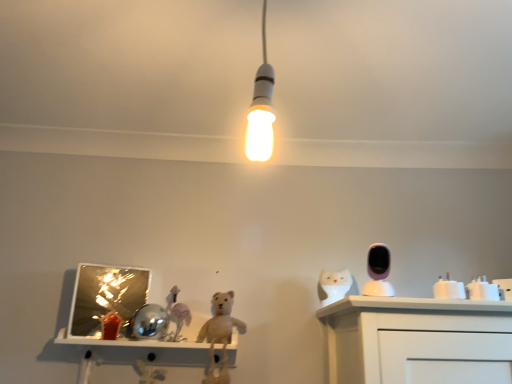
Question: From the image's perspective, is white glossy cup at right, the 2th toy in the front-to-back sequence, beneath white glossy plug at right, the 4th toy positioned from the left?

Choices:
 (A) yes
 (B) no

Answer: (B)

Question: Does white glossy cup at right, the 2th toy in the front-to-back sequence, have a lesser width compared to white glossy plug at right, placed as the third toy when sorted from front to back?

Choices:
 (A) no
 (B) yes

Answer: (A)

Question: Is white glossy cup at right, which is the third toy from back to front, further to camera compared to white glossy plug at right, which is the 1th toy from right to left?

Choices:
 (A) yes
 (B) no

Answer: (B)

Question: Is white glossy cup at right, the 2th toy in the right-to-left sequence, positioned in front of white glossy plug at right, which is the 1th toy from right to left?

Choices:
 (A) no
 (B) yes

Answer: (B)

Question: Is white glossy cup at right, the 2th toy in the front-to-back sequence, with white glossy plug at right, which ranks as the 2th toy in back-to-front order?

Choices:
 (A) no
 (B) yes

Answer: (B)

Question: Is white glossy cup at right, which is the third toy from left to right, positioned with its back to white glossy plug at right, the 4th toy positioned from the left?

Choices:
 (A) yes
 (B) no

Answer: (B)

Question: Is white glossy plug at right, placed as the third toy when sorted from front to back, outside of white glossy cup at right, the 2th toy in the front-to-back sequence?

Choices:
 (A) no
 (B) yes

Answer: (B)

Question: Is white glossy plug at right, the 4th toy positioned from the left, far from white glossy cup at right, which is the third toy from back to front?

Choices:
 (A) yes
 (B) no

Answer: (B)

Question: Could you tell me if white glossy plug at right, which ranks as the 2th toy in back-to-front order, is facing white glossy cup at right, the 2th toy in the right-to-left sequence?

Choices:
 (A) yes
 (B) no

Answer: (B)

Question: Does white glossy plug at right, which ranks as the 2th toy in back-to-front order, have a larger size compared to white glossy cup at right, the 2th toy in the right-to-left sequence?

Choices:
 (A) yes
 (B) no

Answer: (A)

Question: Can you confirm if white glossy plug at right, which ranks as the 2th toy in back-to-front order, is positioned to the right of white glossy cup at right, which is the third toy from left to right?

Choices:
 (A) no
 (B) yes

Answer: (B)

Question: Is white glossy plug at right, which ranks as the 2th toy in back-to-front order, in front of white glossy cup at right, the 2th toy in the right-to-left sequence?

Choices:
 (A) yes
 (B) no

Answer: (B)

Question: Is white glossy owl at right to the right of white glossy plug at right, which ranks as the 2th toy in back-to-front order, from the viewer's perspective?

Choices:
 (A) yes
 (B) no

Answer: (B)